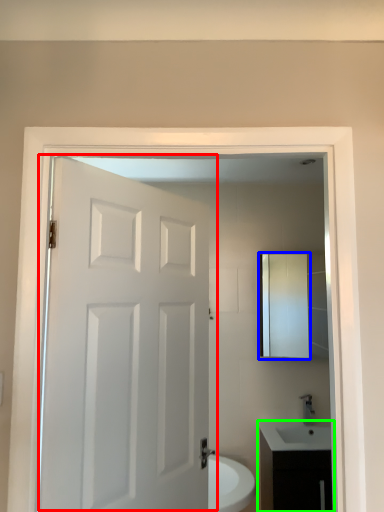
Question: Estimate the real-world distances between objects in this image. Which object is farther from door (highlighted by a red box), medicine cabinet (highlighted by a blue box) or bathroom cabinet (highlighted by a green box)?

Choices:
 (A) medicine cabinet
 (B) bathroom cabinet

Answer: (A)